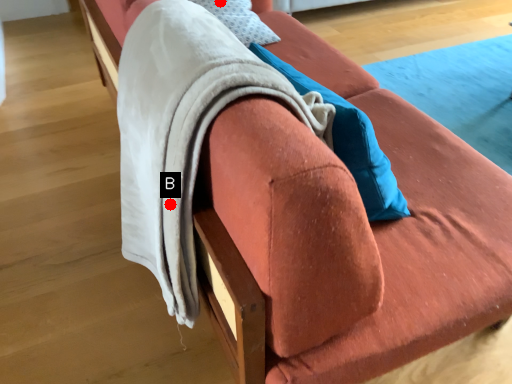
Question: Two points are circled on the image, labeled by A and B beside each circle. Which point is closer to the camera taking this photo?

Choices:
 (A) A is closer
 (B) B is closer

Answer: (B)